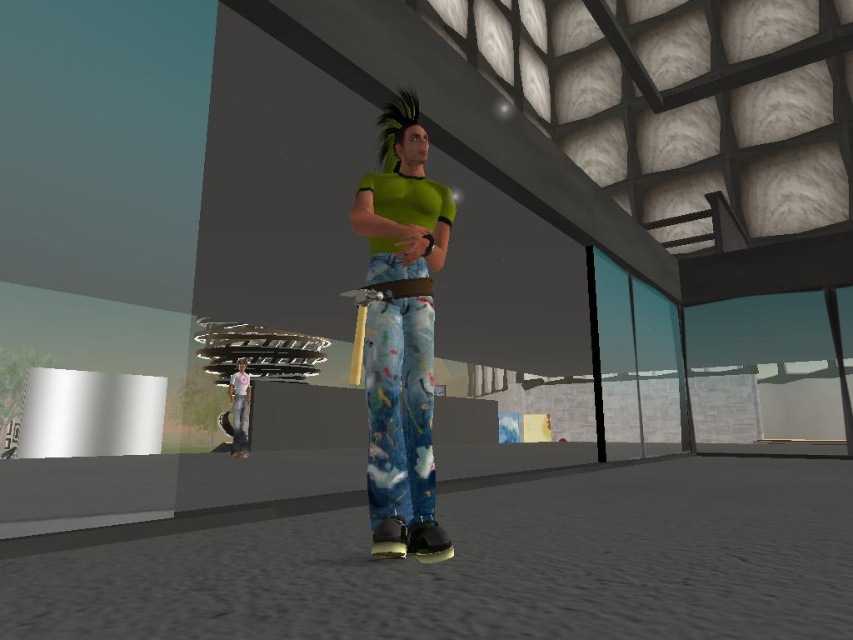
Question: Which object is positioned farthest from the light blue denim pants at lower left?

Choices:
 (A) painted denim pants at center
 (B) green spiky hair at center

Answer: (A)

Question: Which of the following is the closest to the observer?

Choices:
 (A) painted denim pants at center
 (B) light blue denim pants at lower left

Answer: (A)

Question: Which object is the farthest from the painted denim pants at center?

Choices:
 (A) green spiky hair at center
 (B) light blue denim pants at lower left

Answer: (B)

Question: Is green spiky hair at center above light blue denim pants at lower left?

Choices:
 (A) no
 (B) yes

Answer: (B)

Question: Is the position of green spiky hair at center less distant than that of light blue denim pants at lower left?

Choices:
 (A) yes
 (B) no

Answer: (A)

Question: From the image, what is the correct spatial relationship of painted denim pants at center in relation to green spiky hair at center?

Choices:
 (A) above
 (B) below

Answer: (B)